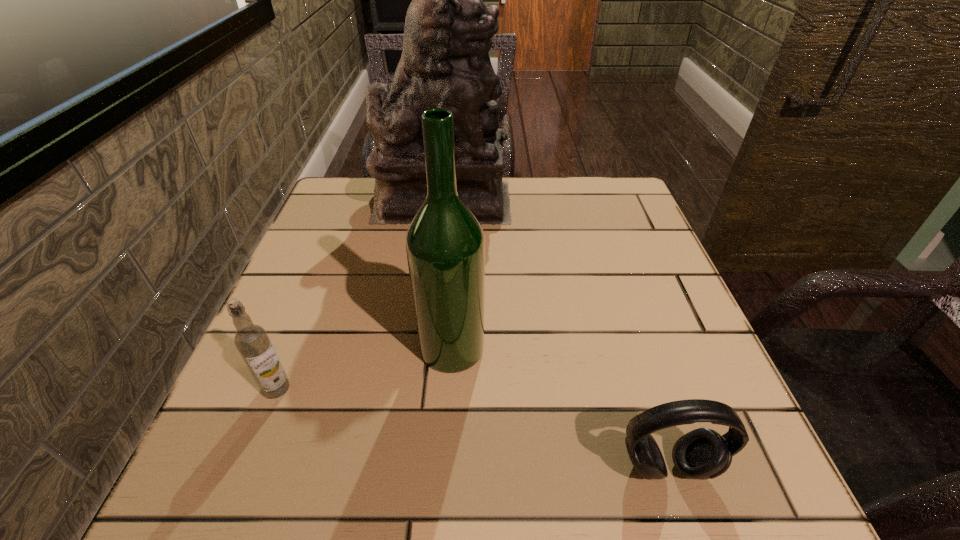
This screenshot has height=540, width=960. I want to click on the farthest object, so click(x=445, y=63).

This screenshot has width=960, height=540. What are the coordinates of `alcohol` in the screenshot? It's located at (445, 245).

The image size is (960, 540). Identify the location of the third farthest object. (252, 341).

The width and height of the screenshot is (960, 540). Find the location of `the second shortest object`. the second shortest object is located at coordinates (252, 341).

Identify the location of the rightmost object. This screenshot has height=540, width=960. (703, 453).

Where is `the nearest object`? The image size is (960, 540). the nearest object is located at coordinates (703, 453).

Find the location of a particular element. The image size is (960, 540). free space located on the front-facing side of the sculpture is located at coordinates (x=635, y=200).

You are a GUI agent. You are given a task and a screenshot of the screen. Output one action in this format:
    pyautogui.click(x=<x>, y=<y>)
    Task: Click on the blank space located 0.220m on the right of the alcohol
    The width and height of the screenshot is (960, 540).
    Given the screenshot: What is the action you would take?
    pyautogui.click(x=612, y=348)

Locate an element on the screen. The width and height of the screenshot is (960, 540). vacant region located on the label of the third farthest object is located at coordinates (250, 457).

Locate an element on the screen. The image size is (960, 540). object situated at the far edge is located at coordinates (445, 63).